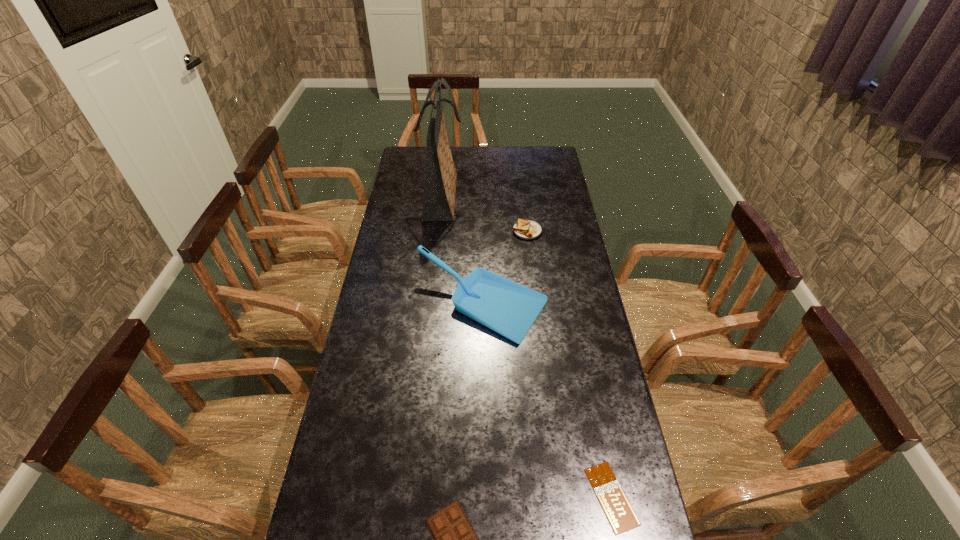
Locate an element on the screen. This screenshot has width=960, height=540. the tallest object is located at coordinates (440, 185).

I want to click on shopping bag, so [440, 185].

The width and height of the screenshot is (960, 540). What are the coordinates of `the second tallest object` in the screenshot? It's located at (506, 307).

Identify the location of the third nearest object. (506, 307).

Image resolution: width=960 pixels, height=540 pixels. I want to click on sandwich, so click(525, 229).

Where is `the fourth nearest object`? Image resolution: width=960 pixels, height=540 pixels. the fourth nearest object is located at coordinates (525, 229).

Image resolution: width=960 pixels, height=540 pixels. Identify the location of the shortest object. (615, 504).

Where is `the rightmost object`? Image resolution: width=960 pixels, height=540 pixels. the rightmost object is located at coordinates (615, 504).

I want to click on free space located on the front-facing side of the farthest object, so click(512, 196).

You are a GUI agent. You are given a task and a screenshot of the screen. Output one action in this format:
    pyautogui.click(x=<x>, y=<y>)
    Task: Click on the free location located 0.170m on the left of the dustpan
    The width and height of the screenshot is (960, 540).
    Given the screenshot: What is the action you would take?
    click(x=366, y=306)